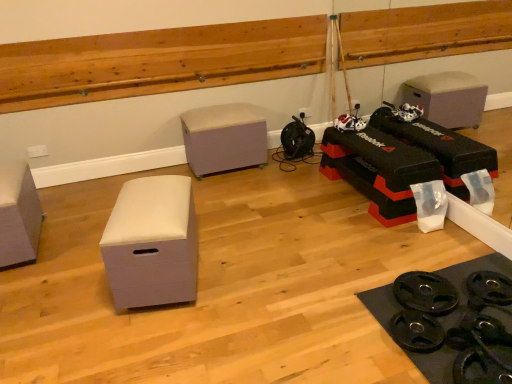
Question: Can you confirm if matte gray storage box at left, placed as the first furniture when sorted from left to right, is wider than beige fabric ottoman at center, which is counted as the 1th furniture, starting from the right?

Choices:
 (A) yes
 (B) no

Answer: (A)

Question: From the image's perspective, is matte gray storage box at left, the second furniture when ordered from front to back, above beige fabric ottoman at center, the 3th furniture positioned from the front?

Choices:
 (A) no
 (B) yes

Answer: (A)

Question: Considering the relative positions of matte gray storage box at left, which is counted as the 2th furniture, starting from the back, and beige fabric ottoman at center, acting as the third furniture starting from the left, in the image provided, is matte gray storage box at left, which is counted as the 2th furniture, starting from the back, to the left of beige fabric ottoman at center, acting as the third furniture starting from the left, from the viewer's perspective?

Choices:
 (A) no
 (B) yes

Answer: (B)

Question: Does matte gray storage box at left, the second furniture when ordered from front to back, appear on the right side of beige fabric ottoman at center, the first furniture in the back-to-front sequence?

Choices:
 (A) no
 (B) yes

Answer: (A)

Question: Is matte gray storage box at left, placed as the third furniture when sorted from right to left, positioned before beige fabric ottoman at center, which is counted as the 1th furniture, starting from the right?

Choices:
 (A) yes
 (B) no

Answer: (A)

Question: Is matte gray storage box at left, which is counted as the 2th furniture, starting from the back, shorter than beige fabric ottoman at center, the first furniture in the back-to-front sequence?

Choices:
 (A) no
 (B) yes

Answer: (B)

Question: Is beige fabric ottoman at center, acting as the third furniture starting from the left, taller than white matte storage box at center-left, which is counted as the 2th furniture, starting from the right?

Choices:
 (A) yes
 (B) no

Answer: (A)

Question: From a real-world perspective, is beige fabric ottoman at center, the 3th furniture positioned from the front, on white matte storage box at center-left, placed as the second furniture when sorted from left to right?

Choices:
 (A) yes
 (B) no

Answer: (A)

Question: Considering the relative sizes of beige fabric ottoman at center, acting as the third furniture starting from the left, and white matte storage box at center-left, which is the 1th furniture from front to back, in the image provided, is beige fabric ottoman at center, acting as the third furniture starting from the left, wider than white matte storage box at center-left, which is the 1th furniture from front to back,?

Choices:
 (A) no
 (B) yes

Answer: (B)

Question: Can you confirm if beige fabric ottoman at center, the 3th furniture positioned from the front, is shorter than white matte storage box at center-left, the 3th furniture in the back-to-front sequence?

Choices:
 (A) no
 (B) yes

Answer: (A)

Question: Is beige fabric ottoman at center, the first furniture in the back-to-front sequence, positioned far away from white matte storage box at center-left, which is the 1th furniture from front to back?

Choices:
 (A) yes
 (B) no

Answer: (A)

Question: Is beige fabric ottoman at center, which is counted as the 1th furniture, starting from the right, at the left side of white matte storage box at center-left, which is counted as the 2th furniture, starting from the right?

Choices:
 (A) yes
 (B) no

Answer: (B)

Question: Is matte gray storage box at left, the second furniture when ordered from front to back, positioned behind wooden ledge at upper center?

Choices:
 (A) no
 (B) yes

Answer: (A)